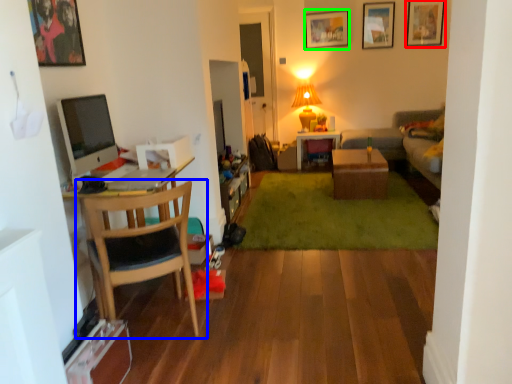
Question: Which object is the farthest from picture frame (highlighted by a red box)? Choose among these: chair (highlighted by a blue box) or picture frame (highlighted by a green box).

Choices:
 (A) chair
 (B) picture frame

Answer: (A)